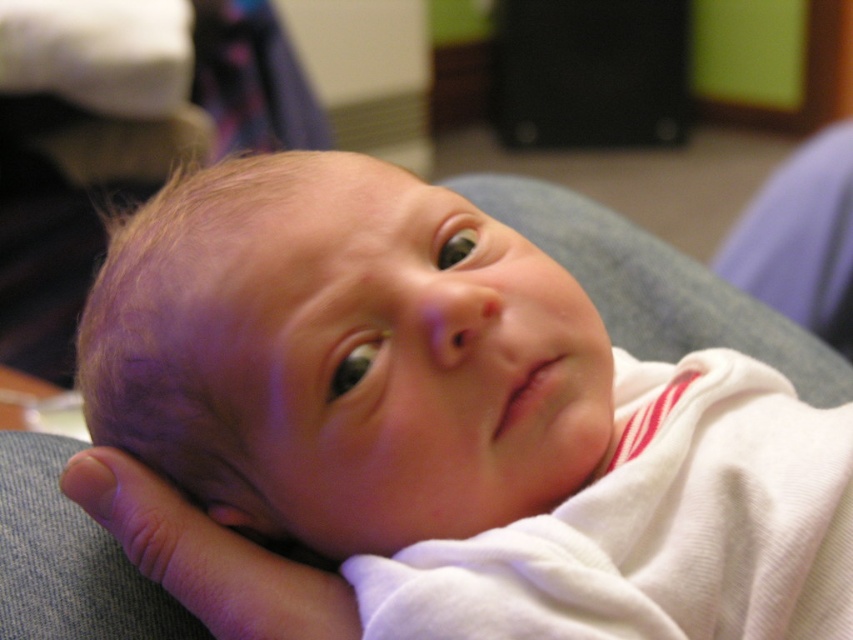
Is white soft baby at center below smooth skin hand at lower left?

Incorrect, white soft baby at center is not positioned below smooth skin hand at lower left.

Between white soft baby at center and smooth skin hand at lower left, which one is positioned lower?

Positioned lower is smooth skin hand at lower left.

Is point (448, 492) positioned in front of point (125, 480)?

Yes, it is in front of point (125, 480).

Image resolution: width=853 pixels, height=640 pixels. What are the coordinates of `white soft baby at center` in the screenshot? It's located at (329, 384).